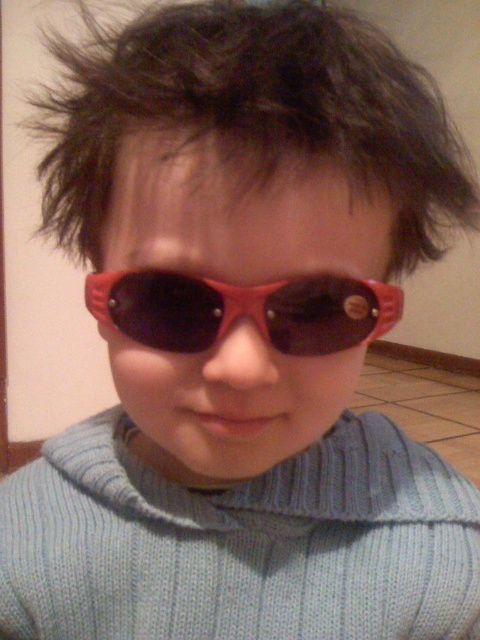
You are a photographer adjusting the lighting for a portrait. You need to ensure that the dark brown spiky hair at upper center and the rubberized red goggles at center are both clearly visible. Given their current positions, which object might cast a shadow over the other, potentially affecting the lighting? Please explain.

The dark brown spiky hair at upper center is positioned over the rubberized red goggles at center. Since the hair is above the goggles, it could cast a shadow on the goggles, making them less visible in the photo. Adjusting the lighting angle or adding fill light might help reduce this shadow.

You are an AI analyzing the position of the dark brown spiky hair at upper center in the image. What are the coordinates of its location?

The dark brown spiky hair at upper center is located at coordinates point (256, 109).

You are a photographer adjusting your camera settings. You notice the dark brown spiky hair at upper center and the rubberized red goggles at center in your frame. Which object is positioned closer to your camera lens?

The dark brown spiky hair at upper center is closer to the viewer than the rubberized red goggles at center, so it is positioned closer to the camera lens.